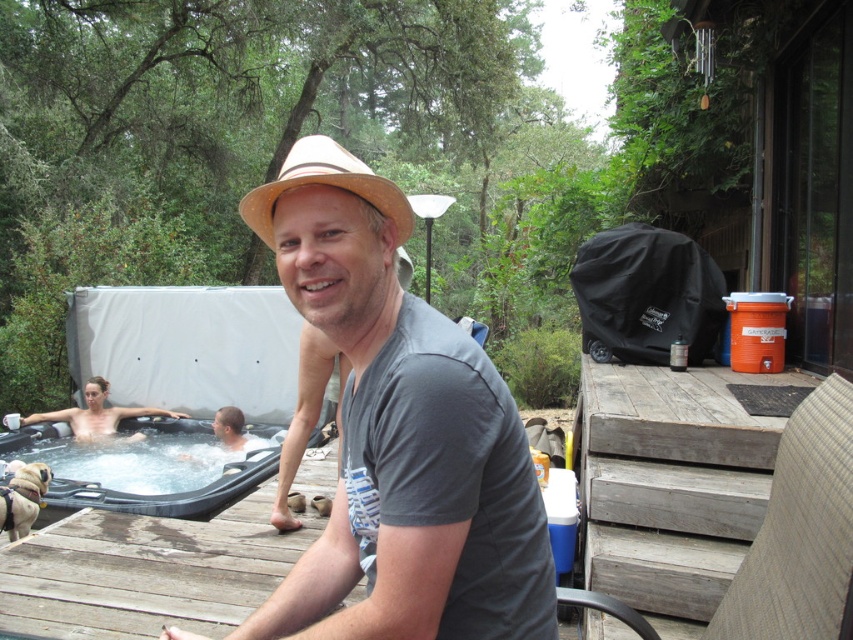
Question: Which point is closer to the camera taking this photo?

Choices:
 (A) coord(102,436)
 (B) coord(77,468)
 (C) coord(752,376)
 (D) coord(312,136)

Answer: (D)

Question: Does tan straw hat at center appear under wooden at center?

Choices:
 (A) no
 (B) yes

Answer: (A)

Question: Is tan straw hat at center above wooden at center?

Choices:
 (A) no
 (B) yes

Answer: (B)

Question: Is wooden at center wider than translucent plastic hot tub at lower left?

Choices:
 (A) yes
 (B) no

Answer: (B)

Question: Which point is closer to the camera?

Choices:
 (A) weathered wood deck at right
 (B) smooth skin woman at lower left

Answer: (A)

Question: Which is nearer to the wooden at center?

Choices:
 (A) weathered wood deck at right
 (B) translucent plastic hot tub at lower left
 (C) straw hat at center

Answer: (C)